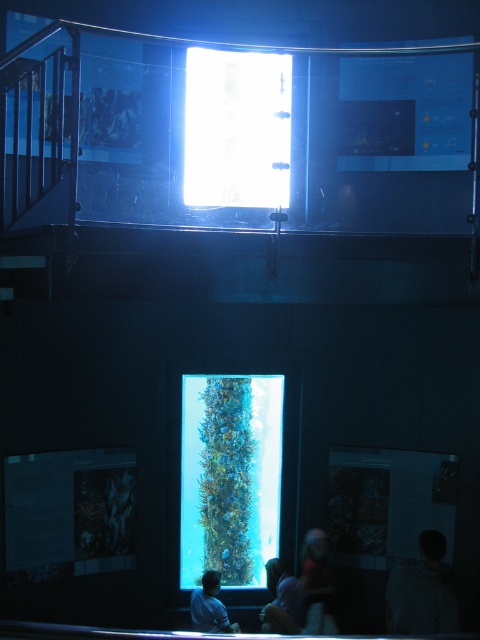
You are a visitor at the aquarium and notice two items near the central aquarium tank. One is a dark gray sweater at lower right and the other is a light blue fabric at lower center. Which item takes up more space in the scene?

The dark gray sweater at lower right is bigger than the light blue fabric at lower center, so it takes up more space in the scene.

You are an employee at the aquarium and need to place a new informational sign. The sign is the size of the light blue fabric shirt at lower center. Is there enough space on the light blue fabric at lower center to place the sign without overlapping?

The light blue fabric at lower center is larger in size than the light blue fabric shirt at lower center. Therefore, there is enough space to place the sign on the light blue fabric at lower center without overlapping.

You are an observer standing in front of the aquarium tank. You notice two items both labeled as light blue fabric at lower center and light blue fabric shirt at lower center. Which one is shorter in height?

The light blue fabric at lower center is shorter in height compared to the light blue fabric shirt at lower center.